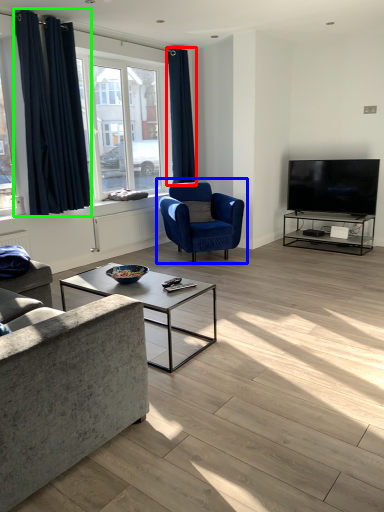
Question: Which object is the farthest from curtain (highlighted by a red box)? Choose among these: chair (highlighted by a blue box) or curtain (highlighted by a green box).

Choices:
 (A) chair
 (B) curtain

Answer: (B)